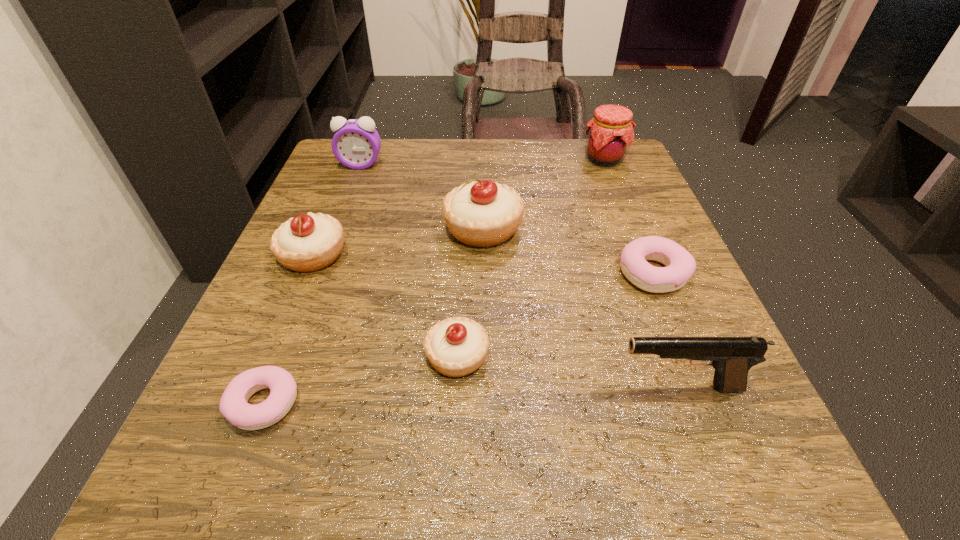
This screenshot has width=960, height=540. Find the location of `jam`. jam is located at coordinates (610, 133).

Identify the location of alarm clock. (356, 144).

Identify the location of the tallest pastry. The height and width of the screenshot is (540, 960). (481, 214).

I want to click on pistol, so click(732, 357).

Image resolution: width=960 pixels, height=540 pixels. Find the location of `the second tallest pastry`. the second tallest pastry is located at coordinates (309, 242).

This screenshot has height=540, width=960. In order to click on the leftmost beige pastry in this screenshot , I will do `click(309, 242)`.

Locate an element on the screen. This screenshot has width=960, height=540. the third shortest pastry is located at coordinates (458, 346).

You are a GUI agent. You are given a task and a screenshot of the screen. Output one action in this format:
    pyautogui.click(x=<x>, y=<y>)
    Task: Click on the third shortest object
    This screenshot has height=540, width=960.
    Given the screenshot: What is the action you would take?
    pyautogui.click(x=458, y=346)

Where is `the bigger pink pastry`? the bigger pink pastry is located at coordinates (680, 265).

You are a GUI agent. You are given a task and a screenshot of the screen. Output one action in this format:
    pyautogui.click(x=<x>, y=<y>)
    Task: Click on the right pink pastry
    
    Given the screenshot: What is the action you would take?
    pyautogui.click(x=680, y=265)